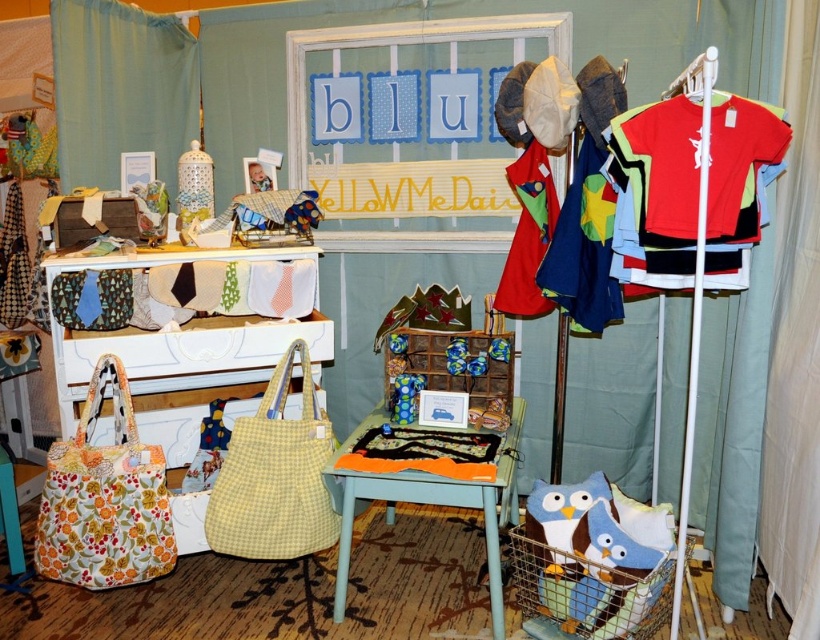
Which is more to the right, white fabric curtain at right or red cotton t-shirt at center?

Positioned to the right is white fabric curtain at right.

Can you confirm if white fabric curtain at right is taller than red cotton t-shirt at center?

Yes.

The width and height of the screenshot is (820, 640). Describe the element at coordinates (795, 348) in the screenshot. I see `white fabric curtain at right` at that location.

The width and height of the screenshot is (820, 640). In order to click on white fabric curtain at right in this screenshot , I will do `click(795, 348)`.

Can you confirm if blue cotton shirt at right is shorter than red cotton t-shirt at center?

In fact, blue cotton shirt at right may be taller than red cotton t-shirt at center.

Does blue cotton shirt at right have a greater height compared to red cotton t-shirt at center?

Yes.

Who is more forward, (572, 232) or (535, 168)?

Positioned in front is point (572, 232).

Where is `blue cotton shirt at right`? blue cotton shirt at right is located at coordinates (582, 248).

Does point (69, 444) come in front of point (534, 161)?

That is True.

Locate an element on the screen. This screenshot has width=820, height=640. floral fabric tote at lower left is located at coordinates (103, 499).

The height and width of the screenshot is (640, 820). Identify the location of floral fabric tote at lower left. (103, 499).